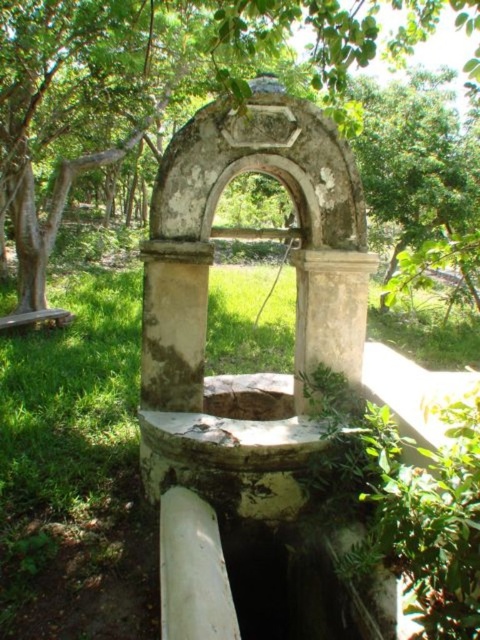
Question: Which of the following is the closest to the observer?

Choices:
 (A) green grass at center
 (B) green leafy tree at center

Answer: (A)

Question: Does green grass at center appear on the left side of green leafy tree at center?

Choices:
 (A) yes
 (B) no

Answer: (A)

Question: Among these objects, which one is farthest from the camera?

Choices:
 (A) green grass at center
 (B) green leafy tree at center

Answer: (B)

Question: Is green grass at center to the right of green leafy tree at center from the viewer's perspective?

Choices:
 (A) no
 (B) yes

Answer: (A)

Question: Is green grass at center smaller than green leafy tree at center?

Choices:
 (A) yes
 (B) no

Answer: (A)